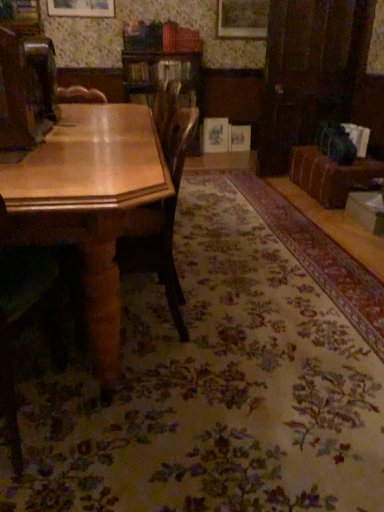
What is the approximate height of wooden chair at center, marked as the 1th chair in a right-to-left arrangement?

wooden chair at center, marked as the 1th chair in a right-to-left arrangement, is 34.91 inches in height.

The image size is (384, 512). What are the coordinates of `wooden chair at left, acting as the 1th chair starting from the left` in the screenshot? It's located at (32, 309).

Locate an element on the screen. The image size is (384, 512). wooden chair at center, marked as the 1th chair in a right-to-left arrangement is located at coordinates (164, 224).

In order to click on couch located on the right of wooden table at left in this screenshot , I will do `click(333, 167)`.

In terms of size, does velvet brown couch at right appear bigger or smaller than wooden table at left?

velvet brown couch at right is smaller than wooden table at left.

Based on the photo, how many degrees apart are the facing directions of velvet brown couch at right and wooden table at left?

The angular difference between velvet brown couch at right and wooden table at left is 89.4 degrees.

Based on the photo, measure the distance between wooden chair at left, the 2th chair in the right-to-left sequence, and wooden table at left.

They are 32.23 centimeters apart.

Is wooden chair at left, the 2th chair in the right-to-left sequence, placed right next to wooden table at left?

wooden chair at left, the 2th chair in the right-to-left sequence, and wooden table at left are clearly separated.

From the image's perspective, between wooden chair at left, acting as the 1th chair starting from the left, and wooden table at left, which one is located above?

wooden table at left, from the image's perspective.

From the image's perspective, is wooden chair at left, the 2th chair in the right-to-left sequence, beneath velvet brown couch at right?

Yes, from the image's perspective, wooden chair at left, the 2th chair in the right-to-left sequence, is beneath velvet brown couch at right.

Which of these two, wooden chair at left, the 2th chair in the right-to-left sequence, or velvet brown couch at right, is wider?

velvet brown couch at right is wider.

Which of these two, wooden chair at left, the 2th chair in the right-to-left sequence, or velvet brown couch at right, stands taller?

Standing taller between the two is wooden chair at left, the 2th chair in the right-to-left sequence.

From a real-world perspective, does wooden chair at left, the 2th chair in the right-to-left sequence, sit lower than wooden chair at center, marked as the 1th chair in a right-to-left arrangement?

Yes, from a real-world perspective, wooden chair at left, the 2th chair in the right-to-left sequence, is below wooden chair at center, marked as the 1th chair in a right-to-left arrangement.

Can you confirm if wooden chair at left, acting as the 1th chair starting from the left, is bigger than wooden chair at center, marked as the 1th chair in a right-to-left arrangement?

No.

Would you say wooden chair at center, marked as the 1th chair in a right-to-left arrangement, is part of wooden chair at left, acting as the 1th chair starting from the left,'s contents?

Actually, wooden chair at center, marked as the 1th chair in a right-to-left arrangement, is outside wooden chair at left, acting as the 1th chair starting from the left.

At what (x,y) coordinates should I click in order to perform the action: click on chair above the wooden chair at left, the 2th chair in the right-to-left sequence (from the image's perspective). Please return your answer as a coordinate pair (x, y). The height and width of the screenshot is (512, 384). Looking at the image, I should click on (164, 224).

From the image's perspective, would you say wooden chair at center, which is the second chair from left to right, is positioned over velvet brown couch at right?

No.

Based on the photo, from a real-world perspective, is wooden chair at center, marked as the 1th chair in a right-to-left arrangement, positioned above or below velvet brown couch at right?

Clearly, from a real-world perspective, wooden chair at center, marked as the 1th chair in a right-to-left arrangement, is above velvet brown couch at right.

Is wooden chair at center, marked as the 1th chair in a right-to-left arrangement, turned away from velvet brown couch at right?

No, wooden chair at center, marked as the 1th chair in a right-to-left arrangement, is not facing away from velvet brown couch at right.

Does point (178, 333) lie in front of point (320, 153)?

That is True.

From a real-world perspective, is wooden table at left positioned above or below velvet brown couch at right?

wooden table at left is above velvet brown couch at right.

From the picture: Which object is further away from the camera taking this photo, wooden table at left or velvet brown couch at right?

velvet brown couch at right is more distant.

Between wooden table at left and velvet brown couch at right, which one has smaller size?

Smaller between the two is velvet brown couch at right.

The width and height of the screenshot is (384, 512). I want to click on the 1st chair below when counting from the wooden table at left (from the image's perspective), so click(x=164, y=224).

From a real-world perspective, between wooden table at left and wooden chair at center, which is the second chair from left to right, who is vertically lower?

wooden table at left, from a real-world perspective.

Is there a large distance between wooden table at left and wooden chair at center, marked as the 1th chair in a right-to-left arrangement?

No, wooden table at left is in close proximity to wooden chair at center, marked as the 1th chair in a right-to-left arrangement.

Considering the sizes of objects wooden table at left and wooden chair at center, marked as the 1th chair in a right-to-left arrangement, in the image provided, who is thinner, wooden table at left or wooden chair at center, marked as the 1th chair in a right-to-left arrangement,?

With smaller width is wooden chair at center, marked as the 1th chair in a right-to-left arrangement.

At what (x,y) coordinates should I click in order to perform the action: click on table below the velvet brown couch at right (from the image's perspective). Please return your answer as a coordinate pair (x, y). The height and width of the screenshot is (512, 384). Looking at the image, I should click on (91, 204).

Identify the location of table behind the wooden chair at left, the 2th chair in the right-to-left sequence. (91, 204).

Considering their positions, is wooden chair at left, acting as the 1th chair starting from the left, positioned further to wooden table at left than wooden chair at center, marked as the 1th chair in a right-to-left arrangement?

The object further to wooden table at left is wooden chair at left, acting as the 1th chair starting from the left.

Considering their positions, is wooden table at left positioned closer to velvet brown couch at right than wooden chair at center, which is the second chair from left to right?

wooden chair at center, which is the second chair from left to right.

Which object lies further to the anchor point wooden chair at center, which is the second chair from left to right, wooden chair at left, the 2th chair in the right-to-left sequence, or velvet brown couch at right?

velvet brown couch at right is further to wooden chair at center, which is the second chair from left to right.

Estimate the real-world distances between objects in this image. Which object is further from velvet brown couch at right, wooden chair at center, which is the second chair from left to right, or wooden table at left?

wooden table at left is positioned further to the anchor velvet brown couch at right.

Based on their spatial positions, is velvet brown couch at right or wooden chair at center, marked as the 1th chair in a right-to-left arrangement, further from wooden table at left?

Among the two, velvet brown couch at right is located further to wooden table at left.

Estimate the real-world distances between objects in this image. Which object is closer to velvet brown couch at right, wooden chair at center, which is the second chair from left to right, or wooden chair at left, acting as the 1th chair starting from the left?

Based on the image, wooden chair at center, which is the second chair from left to right, appears to be nearer to velvet brown couch at right.

Considering their positions, is velvet brown couch at right positioned further to wooden chair at left, acting as the 1th chair starting from the left, than wooden table at left?

velvet brown couch at right is further to wooden chair at left, acting as the 1th chair starting from the left.

In the scene shown: Estimate the real-world distances between objects in this image. Which object is closer to wooden chair at center, which is the second chair from left to right, velvet brown couch at right or wooden table at left?

Among the two, wooden table at left is located nearer to wooden chair at center, which is the second chair from left to right.

Locate an element on the screen. The height and width of the screenshot is (512, 384). table between wooden chair at left, the 2th chair in the right-to-left sequence, and velvet brown couch at right from front to back is located at coordinates (91, 204).

What are the coordinates of `chair between wooden chair at left, the 2th chair in the right-to-left sequence, and velvet brown couch at right in the front-back direction` in the screenshot? It's located at (x=164, y=224).

Identify the location of chair between wooden table at left and velvet brown couch at right along the z-axis. The width and height of the screenshot is (384, 512). (164, 224).

Where is `chair located between wooden table at left and wooden chair at center, marked as the 1th chair in a right-to-left arrangement, in the left-right direction`? Image resolution: width=384 pixels, height=512 pixels. chair located between wooden table at left and wooden chair at center, marked as the 1th chair in a right-to-left arrangement, in the left-right direction is located at coordinates (32, 309).